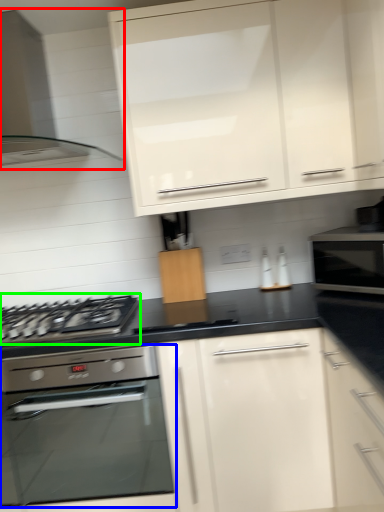
Question: Considering the real-world distances, which object is closest to home appliance (highlighted by a red box)? kitchen appliance (highlighted by a blue box) or gas stove (highlighted by a green box).

Choices:
 (A) kitchen appliance
 (B) gas stove

Answer: (B)